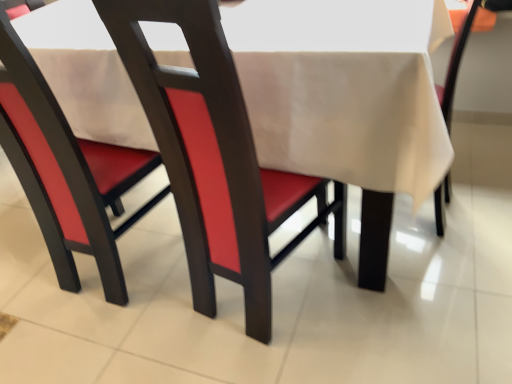
Question: Is matte red chair at center, acting as the 1th chair starting from the left, smaller than matte wood chair at center, which is counted as the second chair, starting from the right?

Choices:
 (A) no
 (B) yes

Answer: (B)

Question: Considering the relative positions of matte red chair at center, arranged as the 3th chair when viewed from the right, and matte wood chair at center, which is counted as the second chair, starting from the right, in the image provided, is matte red chair at center, arranged as the 3th chair when viewed from the right, to the right of matte wood chair at center, which is counted as the second chair, starting from the right, from the viewer's perspective?

Choices:
 (A) yes
 (B) no

Answer: (B)

Question: Is matte red chair at center, acting as the 1th chair starting from the left, positioned beyond the bounds of matte wood chair at center, which is counted as the second chair, starting from the right?

Choices:
 (A) no
 (B) yes

Answer: (B)

Question: From a real-world perspective, is matte red chair at center, arranged as the 3th chair when viewed from the right, on matte wood chair at center, arranged as the second chair when viewed from the left?

Choices:
 (A) yes
 (B) no

Answer: (A)

Question: Is matte red chair at center, arranged as the 3th chair when viewed from the right, to the left of matte wood chair at center, arranged as the second chair when viewed from the left, from the viewer's perspective?

Choices:
 (A) yes
 (B) no

Answer: (A)

Question: Choose the correct answer: Is beige fabric chair at center, the 3th chair from the left, inside matte red chair at center, arranged as the 3th chair when viewed from the right, or outside it?

Choices:
 (A) outside
 (B) inside

Answer: (A)

Question: In the image, is beige fabric chair at center, marked as the 1th chair in a right-to-left arrangement, on the left side or the right side of matte red chair at center, acting as the 1th chair starting from the left?

Choices:
 (A) left
 (B) right

Answer: (B)

Question: From their relative heights in the image, would you say beige fabric chair at center, the 3th chair from the left, is taller or shorter than matte red chair at center, arranged as the 3th chair when viewed from the right?

Choices:
 (A) short
 (B) tall

Answer: (A)

Question: Is beige fabric chair at center, the 3th chair from the left, in front of or behind matte red chair at center, acting as the 1th chair starting from the left, in the image?

Choices:
 (A) behind
 (B) front

Answer: (A)

Question: In the image, is beige fabric tablecloth at center positioned in front of or behind matte red chair at center, arranged as the 3th chair when viewed from the right?

Choices:
 (A) front
 (B) behind

Answer: (A)

Question: In terms of width, does beige fabric tablecloth at center look wider or thinner when compared to matte red chair at center, arranged as the 3th chair when viewed from the right?

Choices:
 (A) wide
 (B) thin

Answer: (A)

Question: Choose the correct answer: Is beige fabric tablecloth at center inside matte red chair at center, acting as the 1th chair starting from the left, or outside it?

Choices:
 (A) inside
 (B) outside

Answer: (B)

Question: Considering the relative positions of beige fabric tablecloth at center and matte red chair at center, arranged as the 3th chair when viewed from the right, in the image provided, is beige fabric tablecloth at center to the left or to the right of matte red chair at center, arranged as the 3th chair when viewed from the right,?

Choices:
 (A) right
 (B) left

Answer: (A)

Question: In terms of height, does matte red chair at center, acting as the 1th chair starting from the left, look taller or shorter compared to beige fabric tablecloth at center?

Choices:
 (A) tall
 (B) short

Answer: (A)

Question: Looking at their shapes, would you say matte red chair at center, arranged as the 3th chair when viewed from the right, is wider or thinner than beige fabric tablecloth at center?

Choices:
 (A) thin
 (B) wide

Answer: (A)